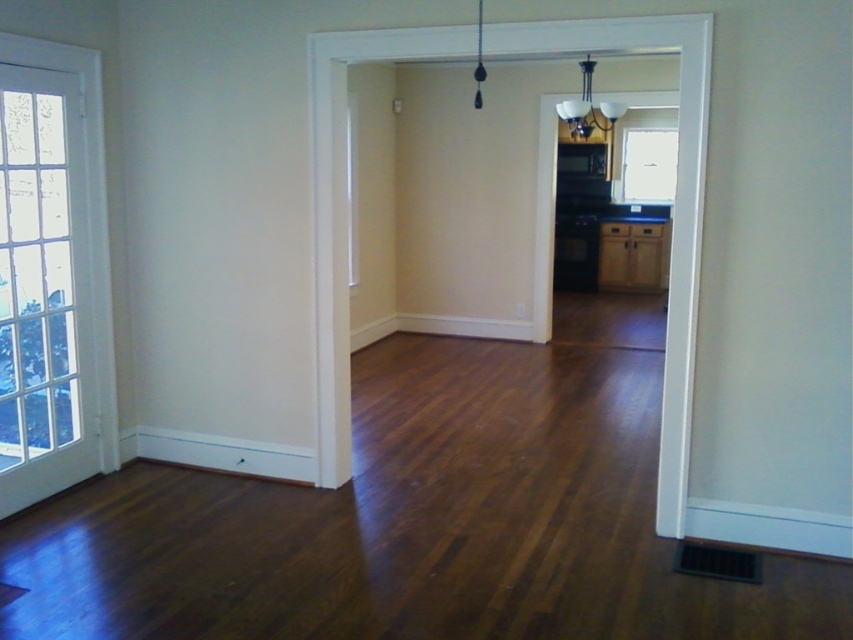
In the scene shown: You are moving a large painting that is 1.5 meters wide. You need to place it on a wall in this room. Which object, the brown wood cabinet at center or the clear glass window at upper center, would you avoid placing it next to to ensure there is enough space?

You should avoid placing the large painting next to the brown wood cabinet at center because it occupies less space than the clear glass window at upper center, meaning there is more available space next to the window.

You are standing in the room and want to move towards the kitchen area. Which of the two points, point (32,451) or point (602,257), is closer to you as you face the kitchen?

Point (32,451) is closer to the viewer than point (602,257), so it is closer to you as you face the kitchen.

You are standing in the room and want to move towards the kitchen area. There are two points marked in the scene, point (608, 243) and point (650, 132). Which point should you walk towards to get closer to the kitchen?

You should walk towards point (608, 243) because it is closer to the camera, which is in the room, so moving towards it would lead you towards the kitchen area.